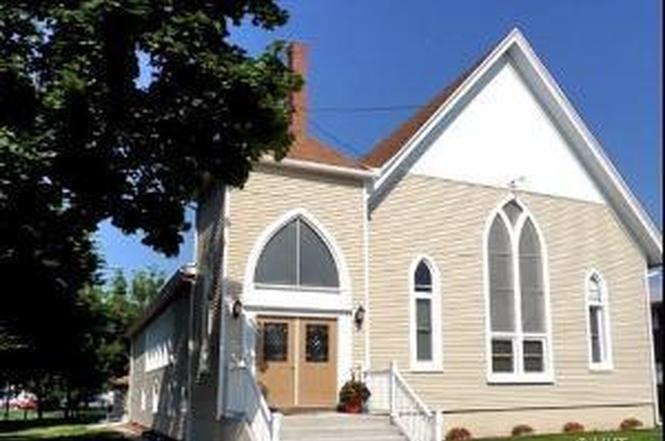
You are a GUI agent. You are given a task and a screenshot of the screen. Output one action in this format:
    pyautogui.click(x=<x>, y=<y>)
    Task: Click on the window
    
    Given the screenshot: What is the action you would take?
    (x=317, y=272)